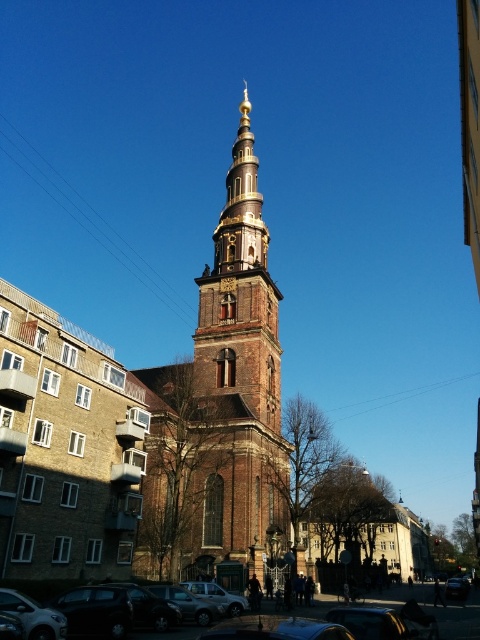
Question: Which point is farther to the camera?

Choices:
 (A) (216, 604)
 (B) (365, 632)
 (C) (13, 596)

Answer: (A)

Question: Which object is positioned closest to the brown brick tower at center?

Choices:
 (A) shiny black car at lower right
 (B) silver metallic car at center
 (C) matte black car at lower left
 (D) metallic silver car at lower left

Answer: (C)

Question: Where is matte black car at lower left located in relation to shiny black car at lower right in the image?

Choices:
 (A) above
 (B) below

Answer: (A)

Question: Does brown brick tower at center appear over metallic silver car at lower left?

Choices:
 (A) yes
 (B) no

Answer: (A)

Question: Can you confirm if metallic silver car at lower left is thinner than shiny silver car at lower center?

Choices:
 (A) yes
 (B) no

Answer: (A)

Question: Among these objects, which one is farthest from the camera?

Choices:
 (A) silver metallic car at center
 (B) shiny silver car at lower center

Answer: (A)